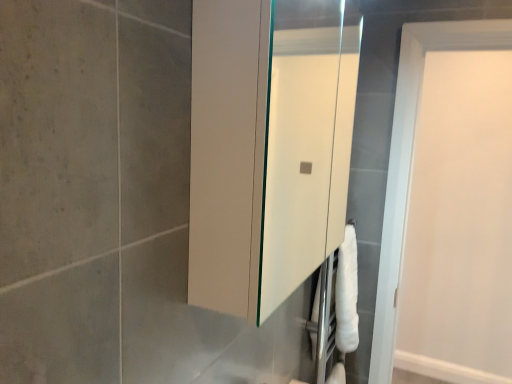
Question: From the image's perspective, is white glossy medicine cabinet at center below white matte toilet paper at lower right?

Choices:
 (A) yes
 (B) no

Answer: (B)

Question: Can you confirm if white glossy medicine cabinet at center is thinner than white matte toilet paper at lower right?

Choices:
 (A) no
 (B) yes

Answer: (A)

Question: Is white glossy medicine cabinet at center turned away from white matte toilet paper at lower right?

Choices:
 (A) no
 (B) yes

Answer: (A)

Question: Can you confirm if white glossy medicine cabinet at center is positioned to the left of white matte toilet paper at lower right?

Choices:
 (A) no
 (B) yes

Answer: (B)

Question: Is white glossy medicine cabinet at center directly adjacent to white matte toilet paper at lower right?

Choices:
 (A) no
 (B) yes

Answer: (A)

Question: Does white glossy medicine cabinet at center have a greater width compared to white matte toilet paper at lower right?

Choices:
 (A) yes
 (B) no

Answer: (A)

Question: Can you confirm if white matte toilet paper at lower right is thinner than white glossy medicine cabinet at center?

Choices:
 (A) yes
 (B) no

Answer: (A)

Question: Can you confirm if white matte toilet paper at lower right is positioned to the left of white glossy medicine cabinet at center?

Choices:
 (A) yes
 (B) no

Answer: (B)

Question: Is white matte toilet paper at lower right not close to white glossy medicine cabinet at center?

Choices:
 (A) yes
 (B) no

Answer: (A)

Question: Is white matte toilet paper at lower right to the right of white glossy medicine cabinet at center from the viewer's perspective?

Choices:
 (A) no
 (B) yes

Answer: (B)

Question: Does white matte toilet paper at lower right contain white glossy medicine cabinet at center?

Choices:
 (A) no
 (B) yes

Answer: (A)

Question: Is the position of white matte toilet paper at lower right more distant than that of white glossy medicine cabinet at center?

Choices:
 (A) yes
 (B) no

Answer: (A)

Question: Considering the relative sizes of white glossy medicine cabinet at center and white matte door at upper right in the image provided, is white glossy medicine cabinet at center taller than white matte door at upper right?

Choices:
 (A) no
 (B) yes

Answer: (A)